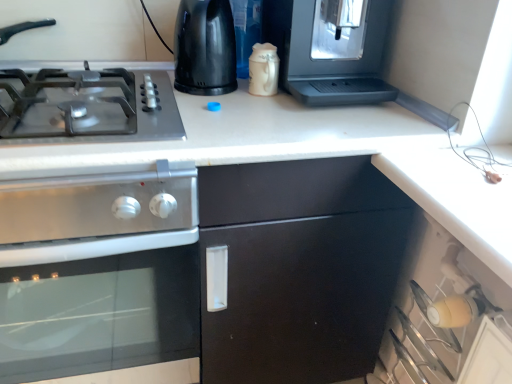
Where is `vacant space underneath black plastic kettle at upper center, the second appliance when ordered from right to left (from a real-world perspective)`? The image size is (512, 384). vacant space underneath black plastic kettle at upper center, the second appliance when ordered from right to left (from a real-world perspective) is located at coordinates pos(208,93).